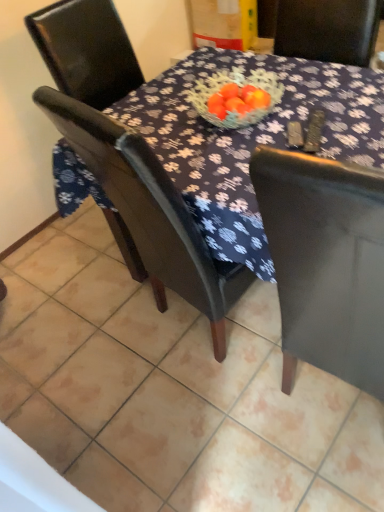
Image resolution: width=384 pixels, height=512 pixels. What do you see at coordinates (149, 214) in the screenshot?
I see `matte black chair at center, the second chair when ordered from top to bottom` at bounding box center [149, 214].

Measure the distance between point (47, 16) and camera.

Point (47, 16) and camera are 5.29 feet apart.

The image size is (384, 512). What are the coordinates of `matte black chair at center, the second chair when ordered from top to bottom` in the screenshot? It's located at (149, 214).

Between matte black chair at center and matte black chair at center, marked as the 1th chair in a bottom-to-top arrangement, which one has smaller width?

matte black chair at center, marked as the 1th chair in a bottom-to-top arrangement, is thinner.

Is matte black chair at center positioned with its back to matte black chair at center, marked as the 1th chair in a bottom-to-top arrangement?

No, matte black chair at center's orientation is not away from matte black chair at center, marked as the 1th chair in a bottom-to-top arrangement.

Is matte black chair at center shorter than matte black chair at center, marked as the 1th chair in a bottom-to-top arrangement?

Yes, matte black chair at center is shorter than matte black chair at center, marked as the 1th chair in a bottom-to-top arrangement.

Are matte black chair at center and matte black chair at center, marked as the 1th chair in a bottom-to-top arrangement, far apart?

No, matte black chair at center is not far from matte black chair at center, marked as the 1th chair in a bottom-to-top arrangement.

Could you tell me if matte black chair at center is facing matte black chair at left, marked as the first chair in a top-to-bottom arrangement?

No, matte black chair at center is not aimed at matte black chair at left, marked as the first chair in a top-to-bottom arrangement.

Between matte black chair at center and matte black chair at left, marked as the first chair in a top-to-bottom arrangement, which one appears on the right side from the viewer's perspective?

From the viewer's perspective, matte black chair at center appears more on the right side.

Between matte black chair at center and matte black chair at left, marked as the first chair in a top-to-bottom arrangement, which one has smaller size?

matte black chair at left, marked as the first chair in a top-to-bottom arrangement, is smaller.

From a real-world perspective, is matte black chair at center on matte black chair at left, marked as the first chair in a top-to-bottom arrangement?

Incorrect, from a real-world perspective, matte black chair at center is lower than matte black chair at left, marked as the first chair in a top-to-bottom arrangement.

Find the location of `tile lying in front of the matte black chair at left, marked as the first chair in a top-to-bottom arrangement`. tile lying in front of the matte black chair at left, marked as the first chair in a top-to-bottom arrangement is located at coordinates (171, 391).

Is matte black chair at left, marked as the first chair in a top-to-bottom arrangement, facing towards matte black chair at center?

No, matte black chair at left, marked as the first chair in a top-to-bottom arrangement, is not oriented towards matte black chair at center.

Looking at this image, does matte black chair at left, marked as the first chair in a top-to-bottom arrangement, have a lesser height compared to matte black chair at center?

No, matte black chair at left, marked as the first chair in a top-to-bottom arrangement, is not shorter than matte black chair at center.

Does point (117, 217) come farther from viewer compared to point (60, 263)?

No, it is not.

Is matte black chair at center, marked as the 1th chair in a bottom-to-top arrangement, bigger than matte black chair at left, marked as the first chair in a top-to-bottom arrangement?

Indeed, matte black chair at center, marked as the 1th chair in a bottom-to-top arrangement, has a larger size compared to matte black chair at left, marked as the first chair in a top-to-bottom arrangement.

Is matte black chair at center, the second chair when ordered from top to bottom, positioned with its back to matte black chair at left, marked as the first chair in a top-to-bottom arrangement?

No, matte black chair at left, marked as the first chair in a top-to-bottom arrangement, is not at the back of matte black chair at center, the second chair when ordered from top to bottom.

In the scene shown: Which is more to the left, matte black chair at center, marked as the 1th chair in a bottom-to-top arrangement, or matte black chair at left, the 2th chair in the bottom-to-top sequence?

From the viewer's perspective, matte black chair at left, the 2th chair in the bottom-to-top sequence, appears more on the left side.

From a real-world perspective, is matte black chair at center, marked as the 1th chair in a bottom-to-top arrangement, positioned over matte black chair at left, the 2th chair in the bottom-to-top sequence, based on gravity?

No, from a real-world perspective, matte black chair at center, marked as the 1th chair in a bottom-to-top arrangement, is not on top of matte black chair at left, the 2th chair in the bottom-to-top sequence.

Measure the distance from matte black chair at left, marked as the first chair in a top-to-bottom arrangement, to matte black chair at center, marked as the 1th chair in a bottom-to-top arrangement.

27.78 inches.

Looking at the image, does matte black chair at left, marked as the first chair in a top-to-bottom arrangement, seem bigger or smaller compared to matte black chair at center, the second chair when ordered from top to bottom?

matte black chair at left, marked as the first chair in a top-to-bottom arrangement, is smaller than matte black chair at center, the second chair when ordered from top to bottom.

Which is more to the left, matte black chair at left, marked as the first chair in a top-to-bottom arrangement, or matte black chair at center, the second chair when ordered from top to bottom?

Positioned to the left is matte black chair at left, marked as the first chair in a top-to-bottom arrangement.

Are matte black chair at center, the second chair when ordered from top to bottom, and matte black chair at center far apart?

That's not correct — matte black chair at center, the second chair when ordered from top to bottom, is a little close to matte black chair at center.

Considering the sizes of objects matte black chair at center, marked as the 1th chair in a bottom-to-top arrangement, and matte black chair at center in the image provided, who is bigger, matte black chair at center, marked as the 1th chair in a bottom-to-top arrangement, or matte black chair at center?

matte black chair at center.

Locate an element on the screen. This screenshot has height=512, width=384. tile located behind the matte black chair at center, the second chair when ordered from top to bottom is located at coordinates (171, 391).

Which object is positioned more to the left, matte black chair at center, the second chair when ordered from top to bottom, or matte black chair at center?

matte black chair at center, the second chair when ordered from top to bottom.

You are a GUI agent. You are given a task and a screenshot of the screen. Output one action in this format:
    pyautogui.click(x=<x>, y=<y>)
    Task: Click on the tile behind the matte black chair at center, marked as the 1th chair in a bottom-to-top arrangement
    This screenshot has width=384, height=512.
    Given the screenshot: What is the action you would take?
    pyautogui.click(x=171, y=391)

From the matte black chair at center, count the 2nd chair to the left and point to it. Please provide its 2D coordinates.

[(86, 50)]

Estimate the real-world distances between objects in this image. Which object is closer to matte black chair at left, the 2th chair in the bottom-to-top sequence, matte black chair at center or matte black chair at center, marked as the 1th chair in a bottom-to-top arrangement?

matte black chair at center, marked as the 1th chair in a bottom-to-top arrangement, lies closer to matte black chair at left, the 2th chair in the bottom-to-top sequence, than the other object.

Considering their positions, is matte black chair at left, the 2th chair in the bottom-to-top sequence, positioned closer to matte black chair at center, the second chair when ordered from top to bottom, than matte black chair at center?

Based on the image, matte black chair at center appears to be nearer to matte black chair at center, the second chair when ordered from top to bottom.

When comparing their distances from matte black chair at center, does matte black chair at left, the 2th chair in the bottom-to-top sequence, or matte black chair at center, marked as the 1th chair in a bottom-to-top arrangement, seem closer?

matte black chair at center, marked as the 1th chair in a bottom-to-top arrangement, is positioned closer to the anchor matte black chair at center.

Based on the photo, looking at the image, which one is located closer to matte black chair at center, matte black chair at center, the second chair when ordered from top to bottom, or matte black chair at left, marked as the first chair in a top-to-bottom arrangement?

The object closer to matte black chair at center is matte black chair at center, the second chair when ordered from top to bottom.

Considering their positions, is matte black chair at center positioned closer to matte black chair at center, the second chair when ordered from top to bottom, than matte black chair at left, marked as the first chair in a top-to-bottom arrangement?

matte black chair at center is positioned closer to the anchor matte black chair at center, the second chair when ordered from top to bottom.

Considering their positions, is matte black chair at center, the second chair when ordered from top to bottom, positioned further to matte black chair at left, the 2th chair in the bottom-to-top sequence, than matte black chair at center?

matte black chair at center is further to matte black chair at left, the 2th chair in the bottom-to-top sequence.

What are the coordinates of `chair between matte black chair at left, the 2th chair in the bottom-to-top sequence, and matte black chair at center` in the screenshot? It's located at (149, 214).